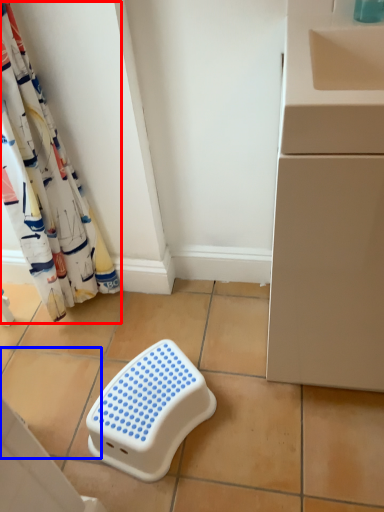
Question: Which object is further to the camera taking this photo, curtain (highlighted by a red box) or ceramic tile (highlighted by a blue box)?

Choices:
 (A) curtain
 (B) ceramic tile

Answer: (B)